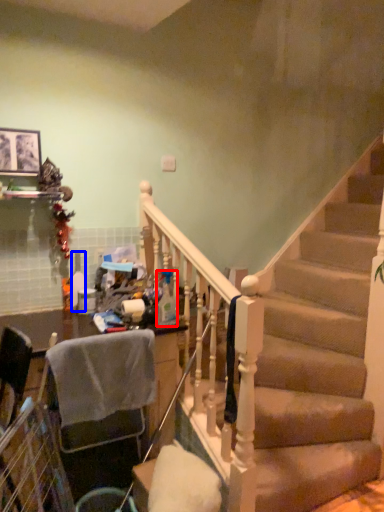
Question: Which of the following is the farthest to the observer, bottle (highlighted by a red box) or bottle (highlighted by a blue box)?

Choices:
 (A) bottle
 (B) bottle

Answer: (B)